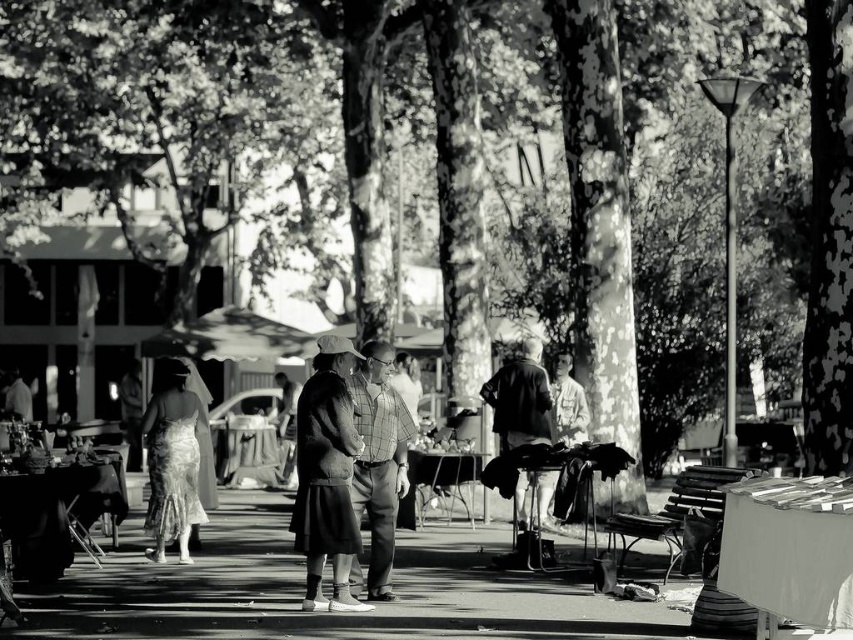
Question: Is checkered fabric jacket at center positioned before light brown textured jacket at center?

Choices:
 (A) no
 (B) yes

Answer: (B)

Question: Among these points, which one is nearest to the camera?

Choices:
 (A) (323, 426)
 (B) (550, 381)
 (C) (351, 568)

Answer: (A)

Question: Is checkered fabric jacket at center wider than silky white dress at center?

Choices:
 (A) yes
 (B) no

Answer: (B)

Question: Can you confirm if checkered fabric shirt at center is positioned below light brown textured jacket at center?

Choices:
 (A) yes
 (B) no

Answer: (A)

Question: Among these points, which one is farthest from the camera?

Choices:
 (A) (335, 452)
 (B) (379, 435)
 (C) (573, 406)
 (D) (173, 381)

Answer: (C)

Question: Which of these objects is positioned closest to the light brown textured jacket at center?

Choices:
 (A) checkered fabric jacket at center
 (B) checkered fabric shirt at center

Answer: (B)